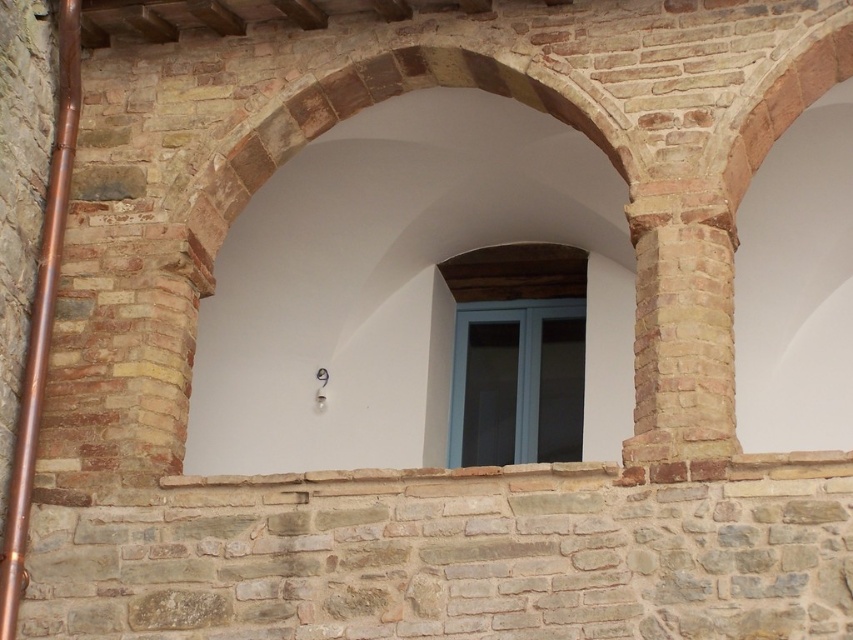
Question: Considering the real-world distances, which object is closest to the blue glass window at center?

Choices:
 (A) smooth stone arch at center
 (B) brown brick column at right

Answer: (A)

Question: Which of the following is the farthest from the observer?

Choices:
 (A) brown brick column at right
 (B) smooth stone arch at center

Answer: (B)

Question: Can you confirm if smooth stone arch at center is positioned to the left of brown brick column at right?

Choices:
 (A) no
 (B) yes

Answer: (B)

Question: Can you confirm if smooth stone arch at center is positioned below brown brick column at right?

Choices:
 (A) no
 (B) yes

Answer: (A)

Question: Considering the real-world distances, which object is farthest from the blue glass window at center?

Choices:
 (A) brown brick column at right
 (B) smooth stone arch at center

Answer: (A)

Question: Is smooth stone arch at center wider than blue glass window at center?

Choices:
 (A) no
 (B) yes

Answer: (B)